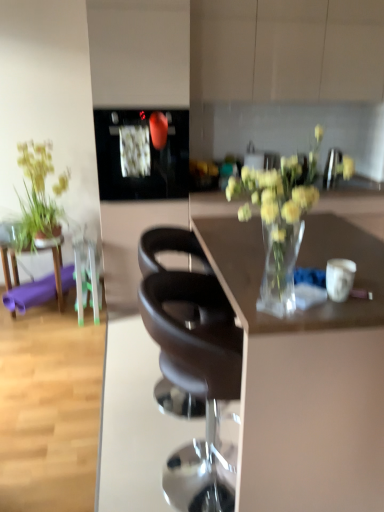
Image resolution: width=384 pixels, height=512 pixels. What are the coordinates of `vacant space positioned to the left of black leather chair at center, the 1th chair when ordered from back to front` in the screenshot? It's located at (96, 401).